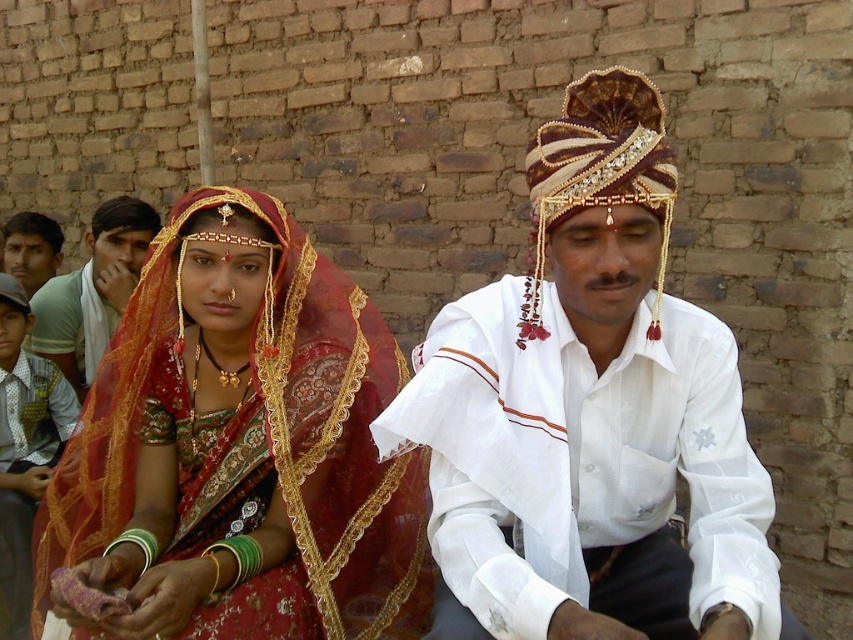
Question: Which point is farther to the camera?

Choices:
 (A) (265, 285)
 (B) (57, 337)
 (C) (53, 269)

Answer: (C)

Question: Can you confirm if white embroidered shirt at center is thinner than matte gold necklace at center?

Choices:
 (A) no
 (B) yes

Answer: (A)

Question: Which object is positioned closest to the matte red saree at center?

Choices:
 (A) matte gold necklace at center
 (B) matte gold bangles at lower left
 (C) white embroidered shirt at center

Answer: (C)

Question: Among these objects, which one is farthest from the camera?

Choices:
 (A) matte green shirt at left
 (B) beaded silk turban at upper right
 (C) white embroidered shirt at center

Answer: (A)

Question: Does matte gold bangles at lower left appear on the right side of matte gold necklace at center?

Choices:
 (A) no
 (B) yes

Answer: (B)

Question: Considering the relative positions of matte red saree at center and matte gold bangles at lower left in the image provided, where is matte red saree at center located with respect to matte gold bangles at lower left?

Choices:
 (A) below
 (B) above

Answer: (B)